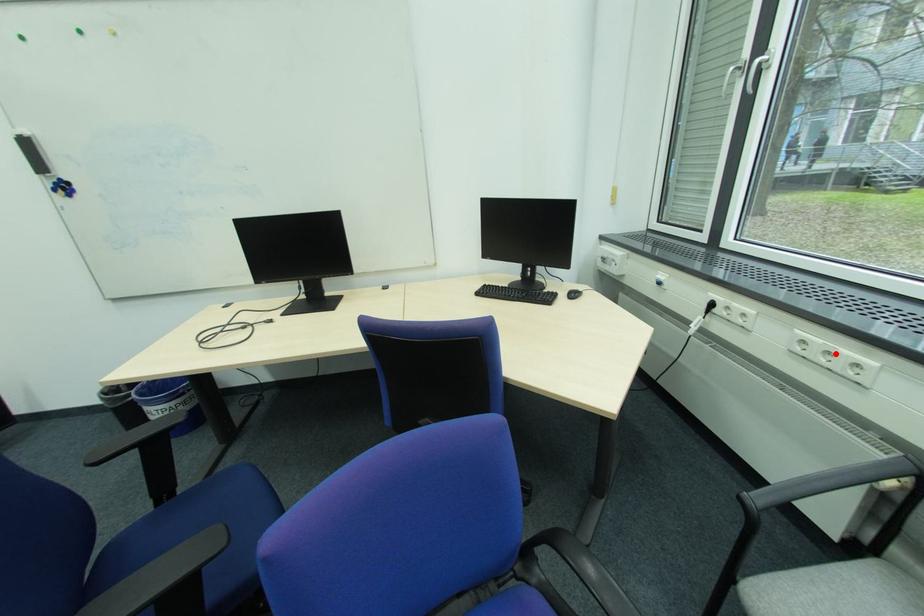
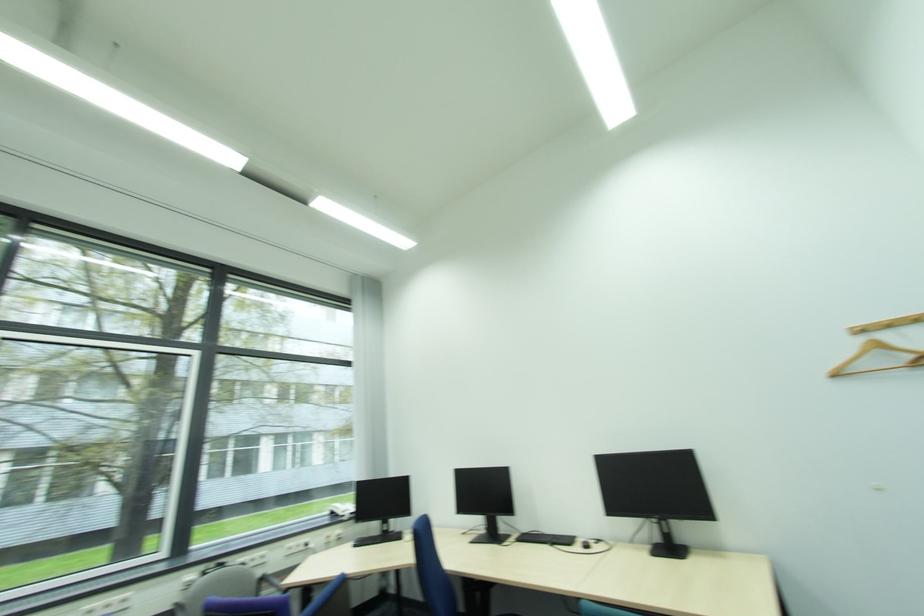
Question: I am providing you with two images of the same scene from different viewpoints. Given a red point in image1, look at the same physical point in image2. Is it:

Choices:
 (A) Closer to the viewpoint
 (B) Farther from the viewpoint

Answer: (A)